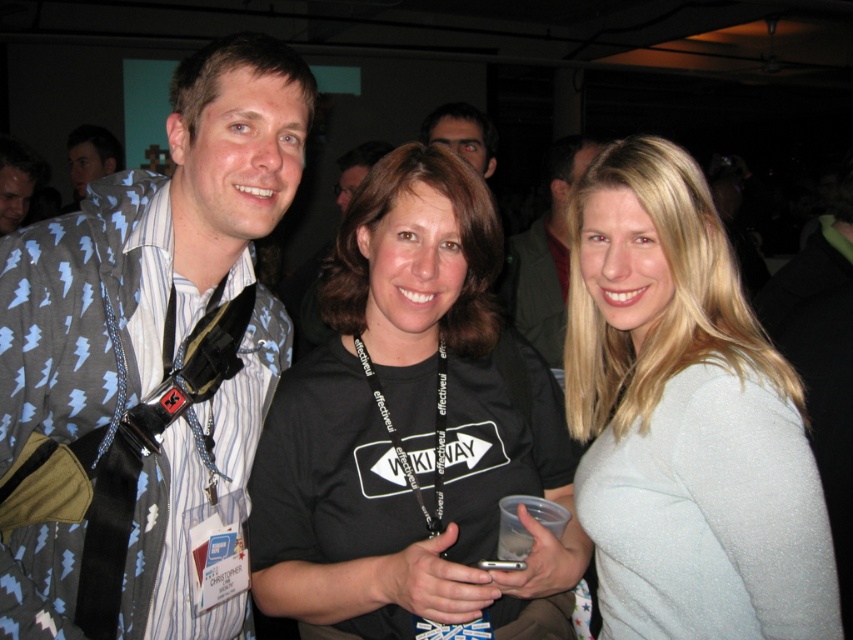
Is point (560, 147) positioned in front of point (113, 140)?

Yes, it is in front of point (113, 140).

Can you confirm if green textured jacket at center is taller than light blue patterned shirt at left?

Correct, green textured jacket at center is much taller as light blue patterned shirt at left.

Is point (550, 275) in front of point (96, 140)?

Yes.

Find the location of a particular element. The image size is (853, 640). green textured jacket at center is located at coordinates (547, 253).

Can you confirm if satin silver sweater at right is thinner than green textured jacket at center?

Correct, satin silver sweater at right's width is less than green textured jacket at center's.

Measure the distance between satin silver sweater at right and camera.

A distance of 36.40 inches exists between satin silver sweater at right and camera.

Where is `satin silver sweater at right`? satin silver sweater at right is located at coordinates [x=685, y=419].

At what (x,y) coordinates should I click in order to perform the action: click on satin silver sweater at right. Please return your answer as a coordinate pair (x, y). Image resolution: width=853 pixels, height=640 pixels. Looking at the image, I should click on (685, 419).

Between black matte shirt at center and satin silver sweater at right, which one is positioned lower?

satin silver sweater at right is below.

Does black matte shirt at center appear over satin silver sweater at right?

Yes, black matte shirt at center is above satin silver sweater at right.

Which is behind, point (335, 282) or point (737, 564)?

Point (335, 282)

In order to click on black matte shirt at center in this screenshot , I will do `click(407, 424)`.